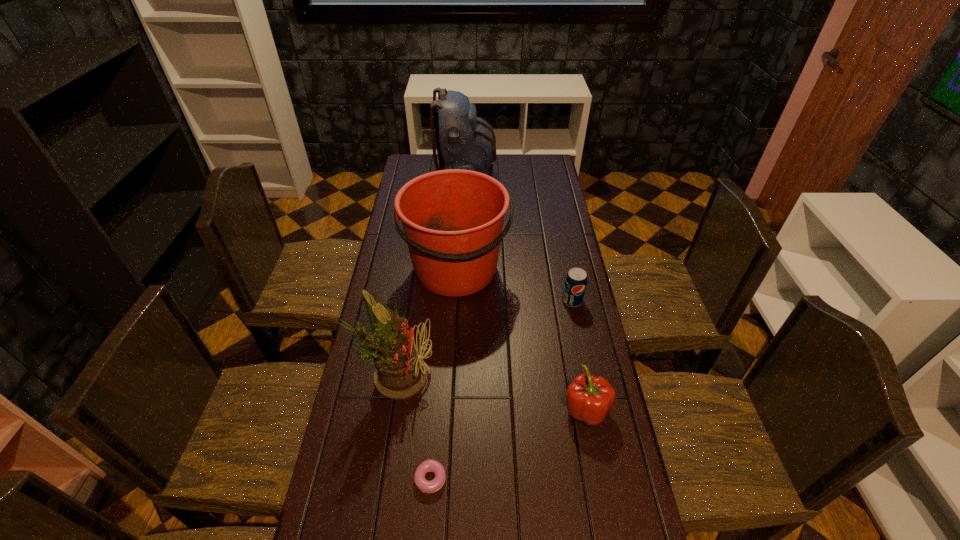
In the image, there is a desktop. Identify the location of vacant space at the far right corner. The height and width of the screenshot is (540, 960). (551, 154).

This screenshot has height=540, width=960. What are the coordinates of `free space that is in between the pepper and the farthest object` in the screenshot? It's located at (526, 293).

This screenshot has height=540, width=960. I want to click on vacant point located between the pepper and the flower arrangement, so click(x=491, y=392).

The image size is (960, 540). Identify the location of free point between the bucket and the pepper. 522,340.

This screenshot has width=960, height=540. Find the location of `vacant point located between the bucket and the flower arrangement`. vacant point located between the bucket and the flower arrangement is located at coordinates (426, 322).

Find the location of a particular element. free spot between the flower arrangement and the bucket is located at coordinates (426, 322).

The height and width of the screenshot is (540, 960). I want to click on free space that is in between the pop and the doughnut, so click(x=503, y=390).

You are a GUI agent. You are given a task and a screenshot of the screen. Output one action in this format:
    pyautogui.click(x=<x>, y=<y>)
    Task: Click on the unoccupied position between the pop and the bucket
    
    Given the screenshot: What is the action you would take?
    pyautogui.click(x=515, y=285)

This screenshot has width=960, height=540. Identify the location of object that ranks as the second closest to the flower arrangement. (452, 219).

Identify which object is located as the third nearest to the flower arrangement. Please provide its 2D coordinates. Your answer should be formatted as a tuple, i.e. [(x, y)], where the tuple contains the x and y coordinates of a point satisfying the conditions above.

[(589, 398)]